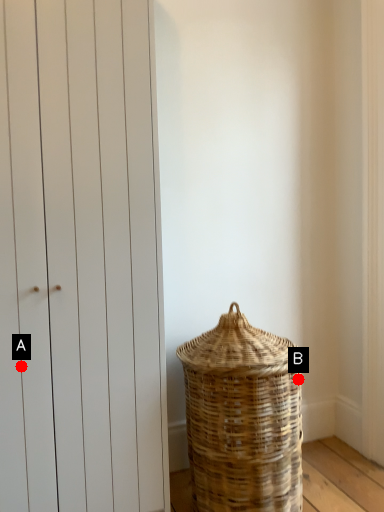
Question: Two points are circled on the image, labeled by A and B beside each circle. Which of the following is the closest to the observer?

Choices:
 (A) A is closer
 (B) B is closer

Answer: (A)